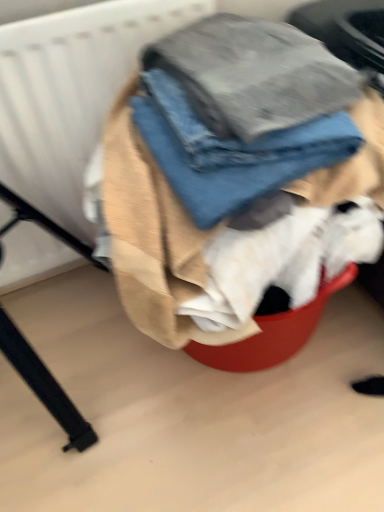
Question: From a real-world perspective, is denim jeans at center above or below denim fabric at center?

Choices:
 (A) above
 (B) below

Answer: (A)

Question: From the image's perspective, is denim jeans at center above or below denim fabric at center?

Choices:
 (A) below
 (B) above

Answer: (B)

Question: Which object is positioned farthest from the denim fabric at center?

Choices:
 (A) denim jeans at center
 (B) white textured radiator at upper left

Answer: (B)

Question: Estimate the real-world distances between objects in this image. Which object is closer to the denim jeans at center?

Choices:
 (A) white textured radiator at upper left
 (B) denim fabric at center

Answer: (B)